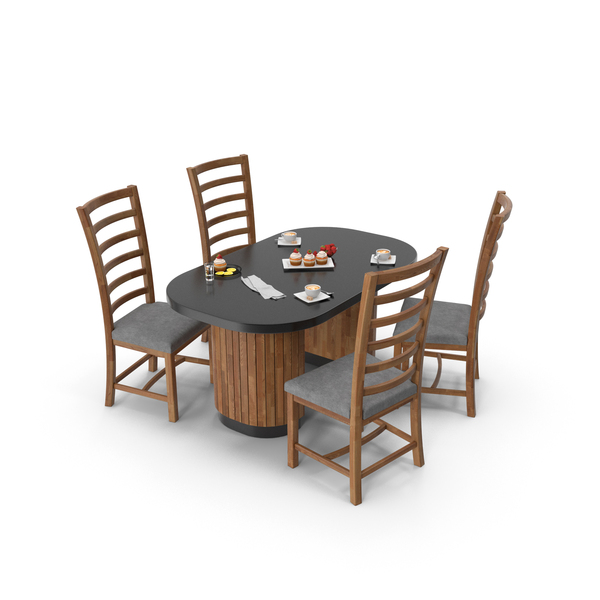
Where is `grey cushion`? This screenshot has height=600, width=600. grey cushion is located at coordinates (344, 384).